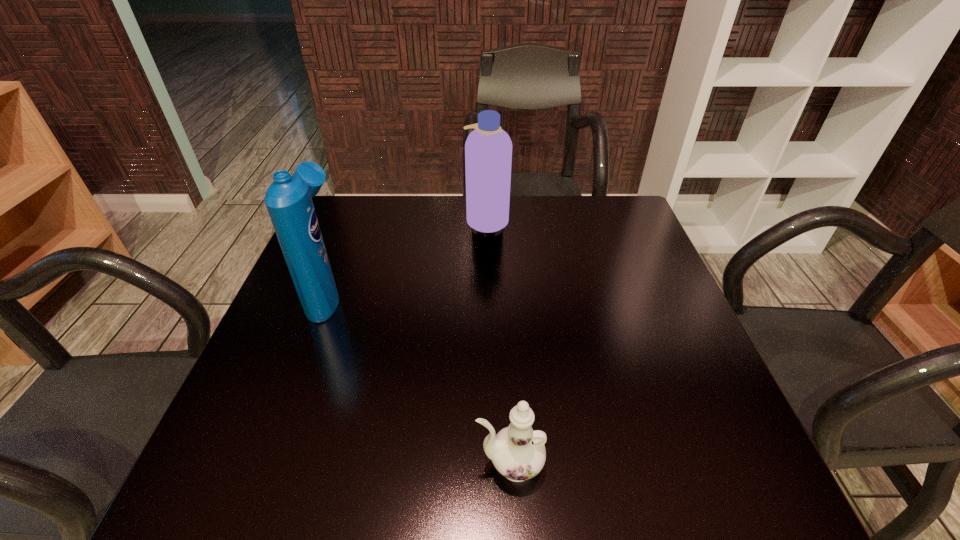
Identify the location of the second closest object to the chinaware. The image size is (960, 540). (488, 149).